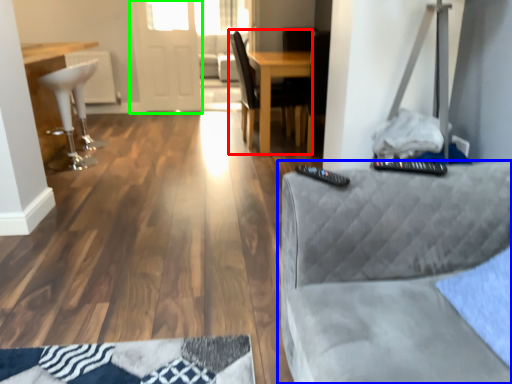
Question: Which object is positioned farthest from chair (highlighted by a red box)? Select from studio couch (highlighted by a blue box) and glass door (highlighted by a green box).

Choices:
 (A) studio couch
 (B) glass door

Answer: (A)